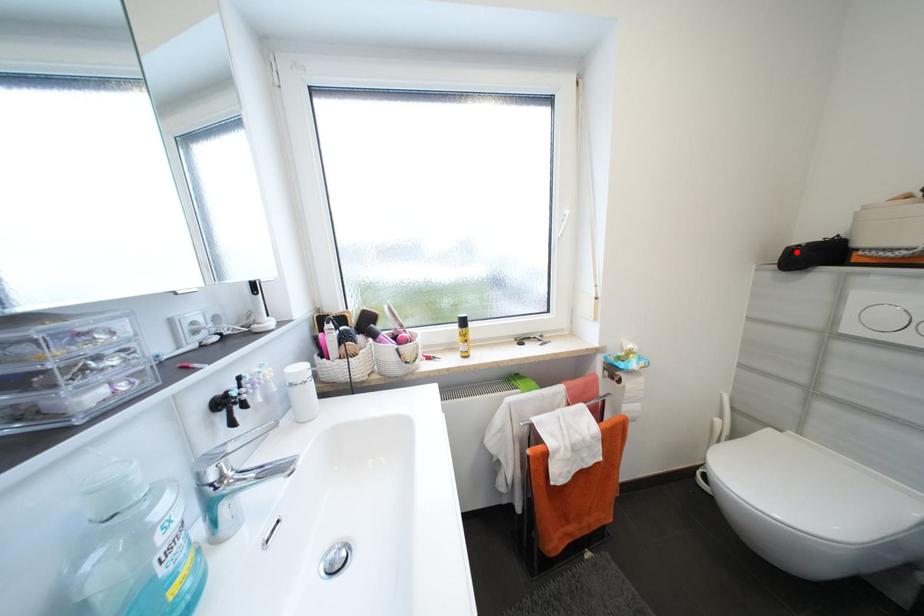
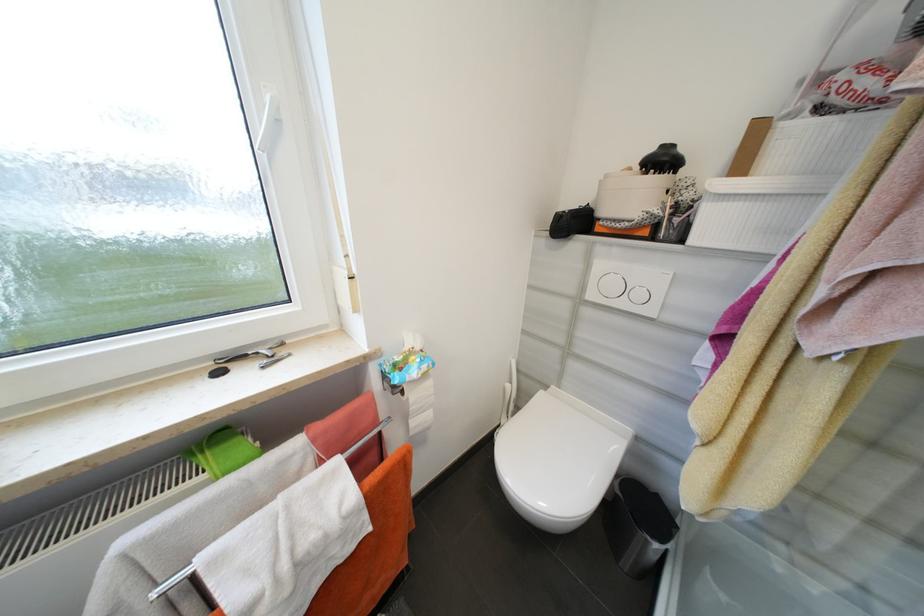
Where in the second image is the point corresponding to the highlighted location from the first image?

(565, 217)